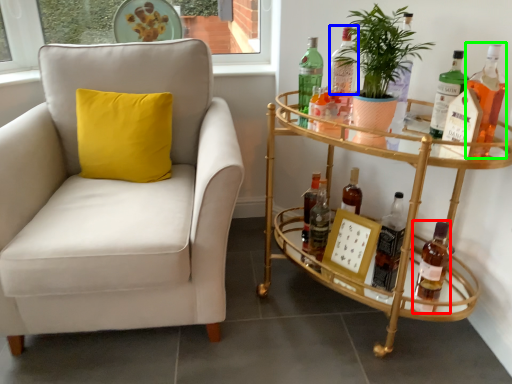
Question: Considering the real-world distances, which object is closest to bottle (highlighted by a red box)? bottle (highlighted by a blue box) or bottle (highlighted by a green box).

Choices:
 (A) bottle
 (B) bottle

Answer: (B)